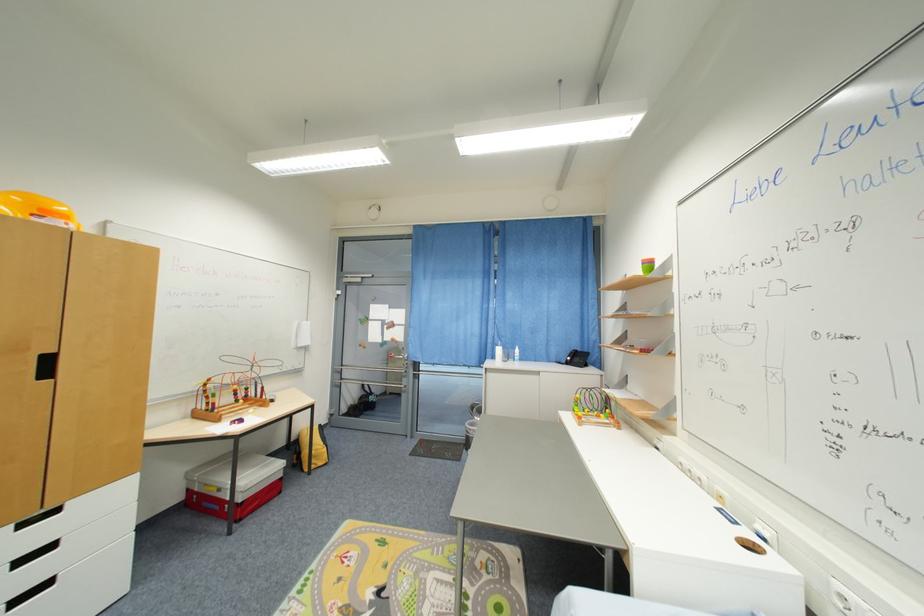
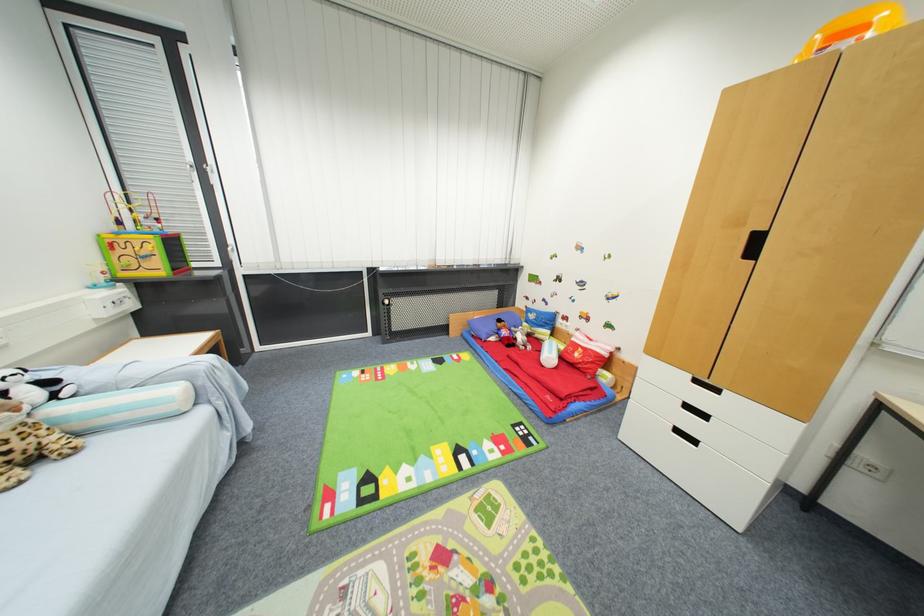
Find the pixel in the second image that matches (28,562) in the first image.

(691, 408)